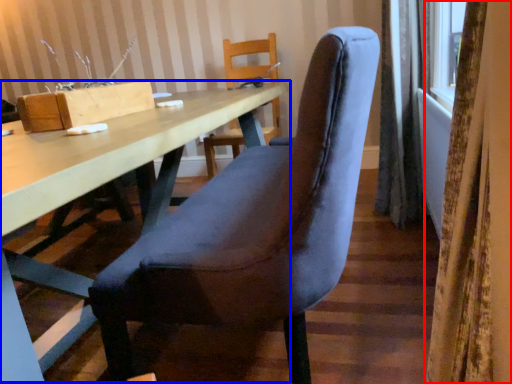
Question: Which of the following is the farthest to the observer, curtain (highlighted by a red box) or table (highlighted by a blue box)?

Choices:
 (A) curtain
 (B) table

Answer: (B)